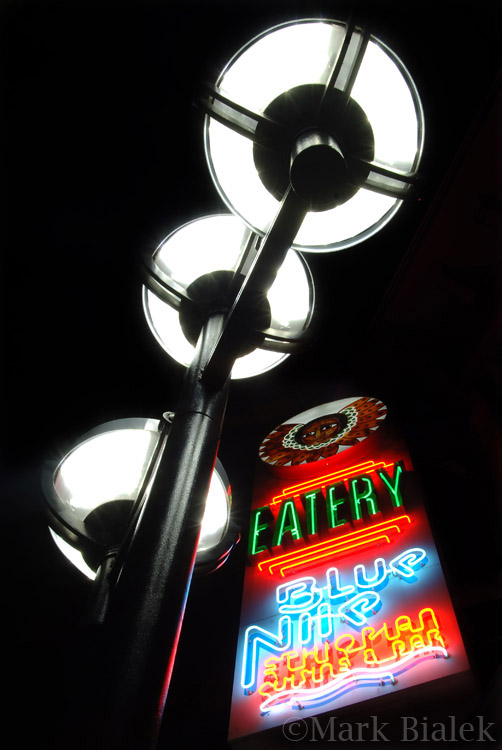
Where is `lights`? lights is located at coordinates (266, 199), (132, 478), (169, 343).